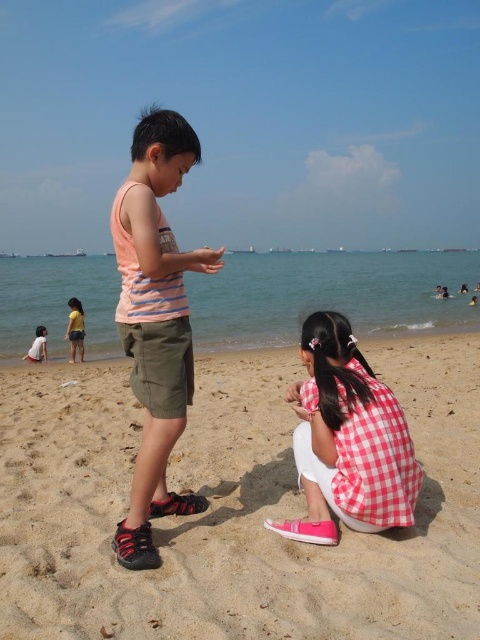
Can you confirm if sandy beach at center is positioned to the left of red checkered shirt at lower center?

In fact, sandy beach at center is to the right of red checkered shirt at lower center.

Which is above, sandy beach at center or red checkered shirt at lower center?

red checkered shirt at lower center

Identify the location of sandy beach at center. The image size is (480, 640). (232, 508).

Looking at this image, can you confirm if red checkered shirt at lower center is wider than yellow cotton shirt at lower left?

Incorrect, red checkered shirt at lower center's width does not surpass yellow cotton shirt at lower left's.

Locate an element on the screen. red checkered shirt at lower center is located at coordinates (348, 440).

Is point (350, 496) closer to camera compared to point (81, 324)?

Yes, it is.

Identify the location of red checkered shirt at lower center. The width and height of the screenshot is (480, 640). (348, 440).

Between point (396, 518) and point (39, 346), which one is positioned in front?

Point (396, 518)

Is point (419, 476) positioned in front of point (32, 355)?

Yes.

At what (x,y) coordinates should I click in order to perform the action: click on red checkered shirt at lower center. Please return your answer as a coordinate pair (x, y). Looking at the image, I should click on (348, 440).

Where is `red checkered shirt at lower center`? This screenshot has width=480, height=640. red checkered shirt at lower center is located at coordinates (348, 440).